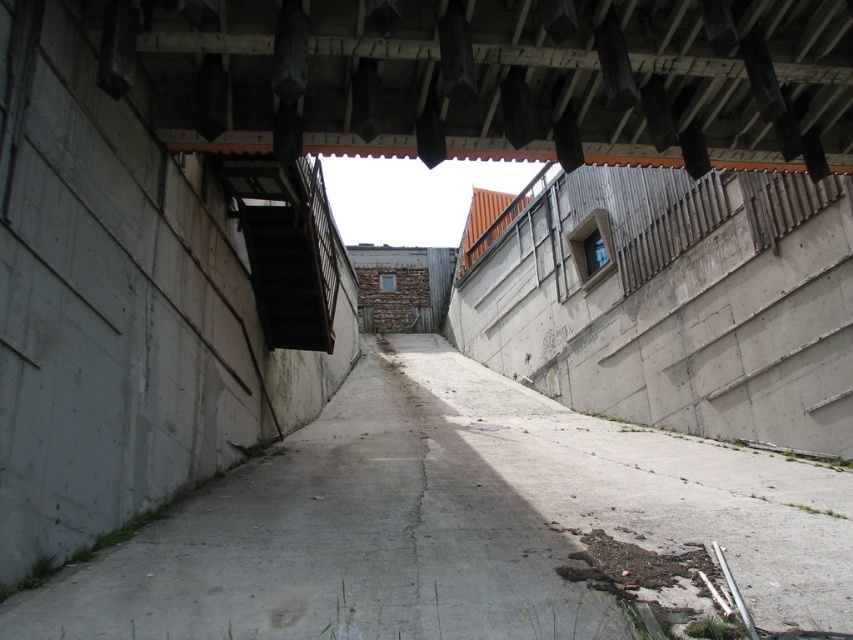
You are a delivery person carrying a tall package that is 2 meters in height. You need to walk through the narrow concrete pathway shown in the image. Based on the concrete at center and the concrete ceiling at upper center, will the package fit through the pathway without hitting the ceiling?

The concrete at center is not as tall as the concrete ceiling at upper center, which means the ceiling is taller than the pathway. However, since the package is 2 meters tall, it depends on the actual height of the ceiling. The description does not provide specific measurements, so we cannot confirm if the package will fit without additional information.

You are a delivery person carrying a heavy box and need to navigate the narrow pathway. The concrete at center and dark gray concrete stairs at upper left are in your way. Which object is located lower in the scene?

The concrete at center is located below the dark gray concrete stairs at upper left, so the concrete at center is lower in the scene.

You are standing at the entrance of the pathway and want to walk towards the distant structure. Which of the two points, point (257, 45) or point (312, 332), is closer to you as you start walking?

Point (257, 45) is closer to the viewer than point (312, 332), so it is the closer point as you start walking.